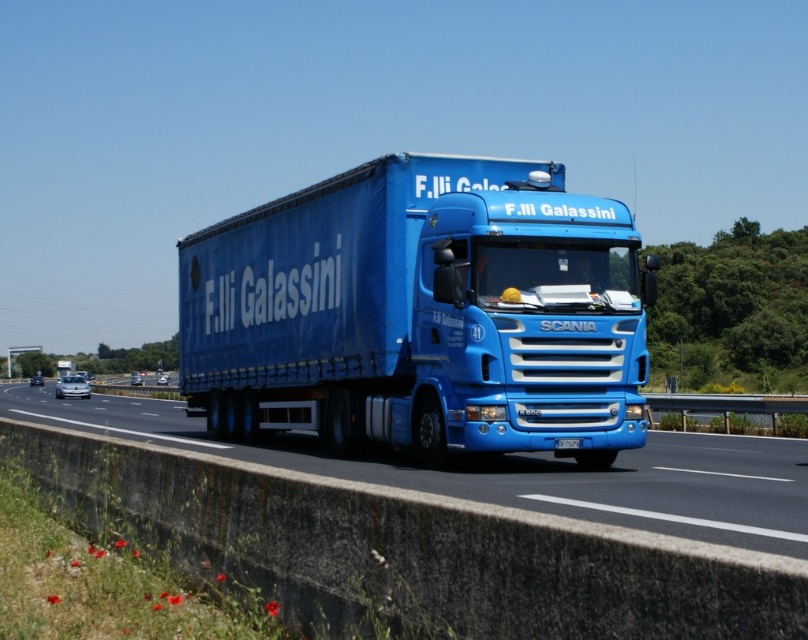
You are a delivery driver planning to load a tall package onto the blue matte trailer truck at center and the blue metallic truck at center. Which truck should you choose to ensure the package fits without exceeding height restrictions?

The blue matte trailer truck at center has a greater height compared to the blue metallic truck at center, so you should choose the blue matte trailer truck at center to ensure the tall package fits without exceeding height restrictions.